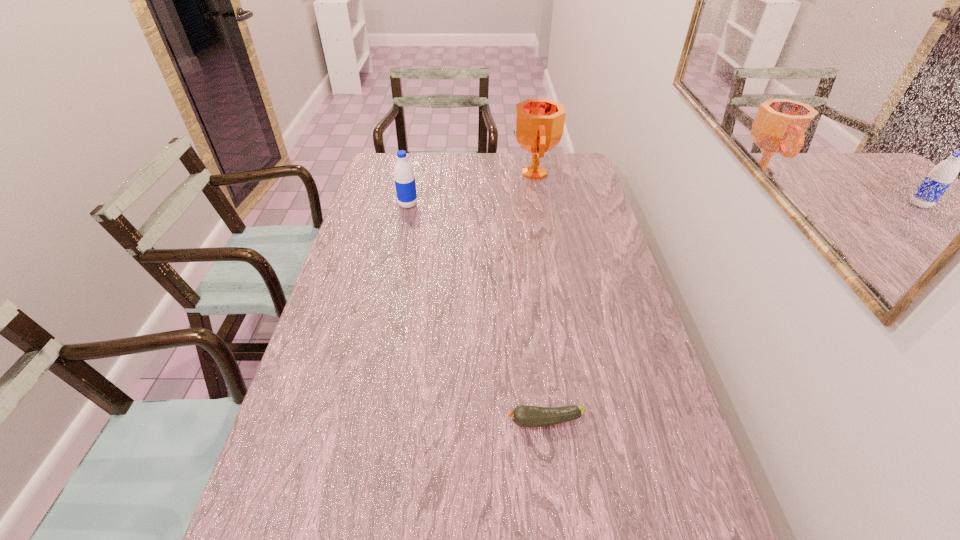
This screenshot has width=960, height=540. In the image, there is a desktop. Identify the location of free space at the far right corner. (555, 175).

Locate an element on the screen. free spot between the leftmost object and the shortest object is located at coordinates (476, 313).

Where is `vacant area between the second shortest object and the nearest object`? vacant area between the second shortest object and the nearest object is located at coordinates (476, 313).

Image resolution: width=960 pixels, height=540 pixels. Find the location of `free space between the second shortest object and the nearest object`. free space between the second shortest object and the nearest object is located at coordinates (476, 313).

You are a GUI agent. You are given a task and a screenshot of the screen. Output one action in this format:
    pyautogui.click(x=<x>, y=<y>)
    Task: Click on the vacant space in between the award and the leftmost object
    This screenshot has width=960, height=540.
    Given the screenshot: What is the action you would take?
    pyautogui.click(x=470, y=189)

Locate an element on the screen. free space between the award and the second nearest object is located at coordinates (470, 189).

Locate an element on the screen. This screenshot has height=540, width=960. free spot between the award and the second shortest object is located at coordinates (470, 189).

Where is `free spot between the tallest object and the nearest object`? Image resolution: width=960 pixels, height=540 pixels. free spot between the tallest object and the nearest object is located at coordinates (540, 297).

Where is `vacant area that lies between the water bottle and the nearest object`? The image size is (960, 540). vacant area that lies between the water bottle and the nearest object is located at coordinates (476, 313).

Where is `free area in between the zucchini and the award`? free area in between the zucchini and the award is located at coordinates (540, 297).